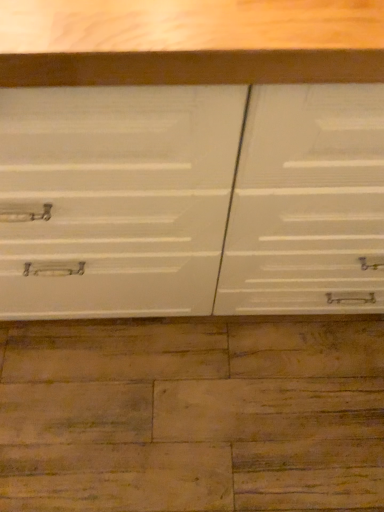
Measure the distance between point (195, 251) and camera.

Point (195, 251) and camera are 29.25 inches apart from each other.

At what (x,y) coordinates should I click in order to perform the action: click on white matte cabinet at center. Please return your answer as a coordinate pair (x, y). This screenshot has width=384, height=512. Looking at the image, I should click on (191, 201).

This screenshot has width=384, height=512. What do you see at coordinates (191, 201) in the screenshot?
I see `white matte cabinet at center` at bounding box center [191, 201].

Locate an element on the screen. The width and height of the screenshot is (384, 512). white matte cabinet at center is located at coordinates (191, 201).